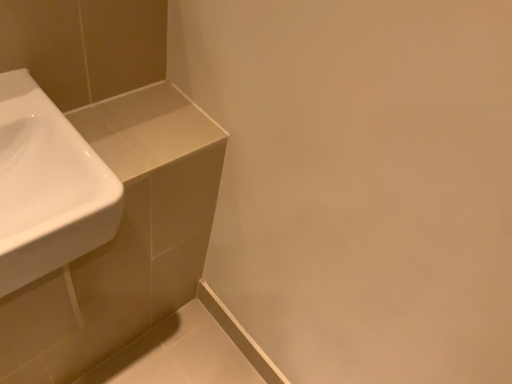
What is the approximate width of white glossy sink at left?

13.75 inches.

Find the location of `white glossy sink at left`. white glossy sink at left is located at coordinates (48, 187).

What do you see at coordinates (48, 187) in the screenshot? I see `white glossy sink at left` at bounding box center [48, 187].

At what (x,y) coordinates should I click in order to perform the action: click on white glossy sink at left. Please return your answer as a coordinate pair (x, y). The width and height of the screenshot is (512, 384). Looking at the image, I should click on (48, 187).